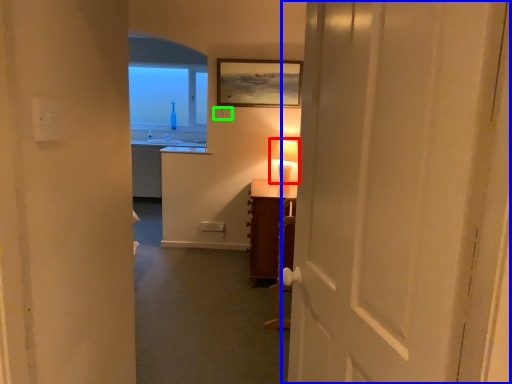
Question: Which object is positioned closest to table lamp (highlighted by a red box)? Select from door (highlighted by a blue box) and electric outlet (highlighted by a green box).

Choices:
 (A) door
 (B) electric outlet

Answer: (B)